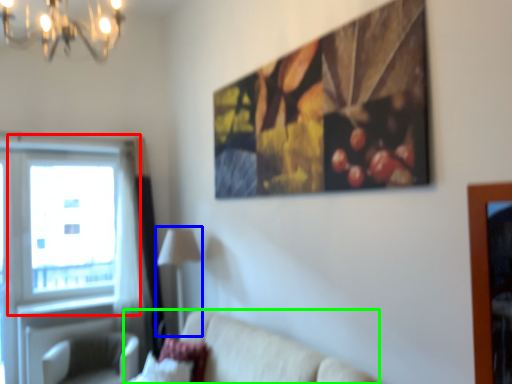
Question: Which object is positioned closest to window (highlighted by a red box)? Select from lamp (highlighted by a blue box) and studio couch (highlighted by a green box).

Choices:
 (A) lamp
 (B) studio couch

Answer: (A)